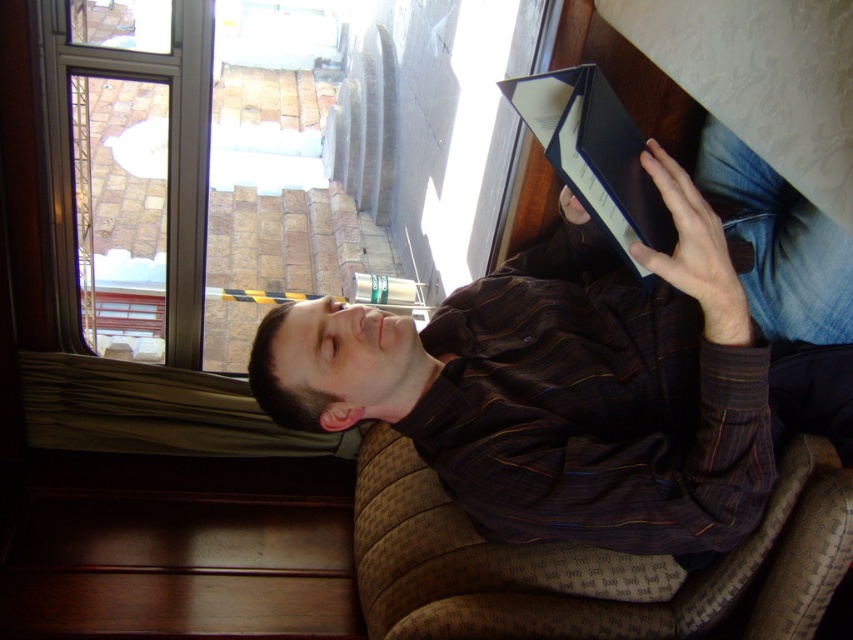
Question: Can you confirm if clear glass window at upper left is positioned below brown striped shirt at upper center?

Choices:
 (A) yes
 (B) no

Answer: (B)

Question: Among these points, which one is farthest from the camera?

Choices:
 (A) (135, 125)
 (B) (851, 346)

Answer: (A)

Question: Is brown striped shirt at center bigger than clear glass window at upper left?

Choices:
 (A) yes
 (B) no

Answer: (B)

Question: Which point is farther to the camera?

Choices:
 (A) brown striped shirt at upper center
 (B) clear glass window at upper left
 (C) brown striped shirt at center

Answer: (B)

Question: Is brown striped shirt at center behind clear glass window at upper left?

Choices:
 (A) yes
 (B) no

Answer: (B)

Question: Which point is closer to the camera?

Choices:
 (A) (315, 356)
 (B) (155, 54)
 (C) (712, 147)

Answer: (A)